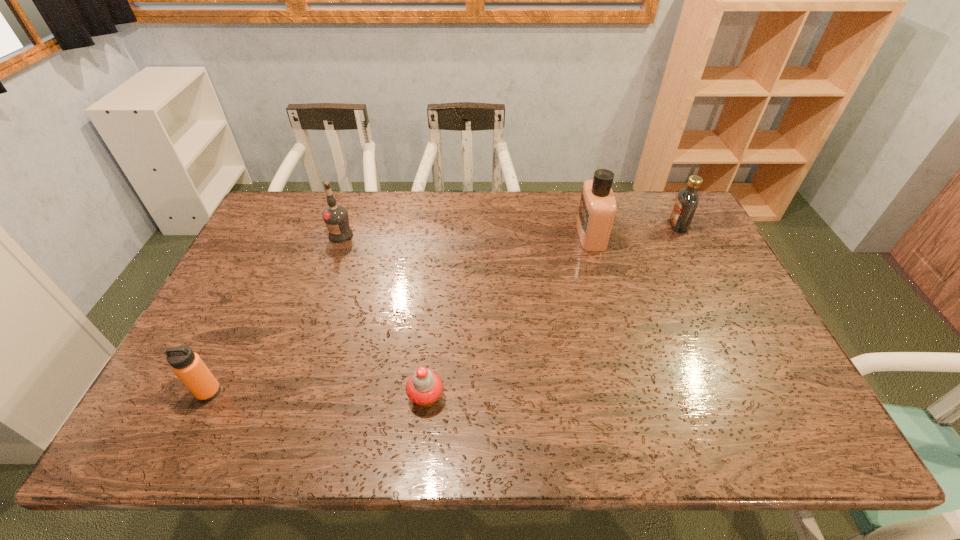
Locate an element on the screen. blank region between the rightmost object and the left vodka is located at coordinates (510, 231).

This screenshot has height=540, width=960. What are the coordinates of `vacant area that lies between the rightmost object and the second object from right to left` in the screenshot? It's located at (635, 231).

Locate an element on the screen. This screenshot has width=960, height=540. free space between the second object from right to left and the right vodka is located at coordinates (635, 231).

The width and height of the screenshot is (960, 540). In order to click on empty space that is in between the right vodka and the cupcake in this screenshot , I will do `click(552, 312)`.

At what (x,y) coordinates should I click in order to perform the action: click on vacant point located between the leftmost object and the fourth object from left to right. Please return your answer as a coordinate pair (x, y). This screenshot has width=960, height=540. Looking at the image, I should click on (399, 313).

Find the location of `unoccupied area between the right vodka and the third object from right to left`. unoccupied area between the right vodka and the third object from right to left is located at coordinates (552, 312).

Identify which object is the second nearest to the thermos bottle. Please provide its 2D coordinates. Your answer should be formatted as a tuple, i.e. [(x, y)], where the tuple contains the x and y coordinates of a point satisfying the conditions above.

[(336, 218)]

Identify which object is the fourth nearest to the cupcake. Please provide its 2D coordinates. Your answer should be formatted as a tuple, i.e. [(x, y)], where the tuple contains the x and y coordinates of a point satisfying the conditions above.

[(687, 201)]

Find the location of a particular element. This screenshot has height=540, width=960. blank area in the image that satisfies the following two spatial constraints: 1. on the front-facing side of the rightmost object; 2. on the front side of the thermos bottle is located at coordinates (761, 392).

You are a GUI agent. You are given a task and a screenshot of the screen. Output one action in this format:
    pyautogui.click(x=<x>, y=<y>)
    Task: Click on the free spot that satisfies the following two spatial constraints: 1. on the front-facing side of the right vodka; 2. on the front side of the third object from left to right
    
    Given the screenshot: What is the action you would take?
    pyautogui.click(x=764, y=397)